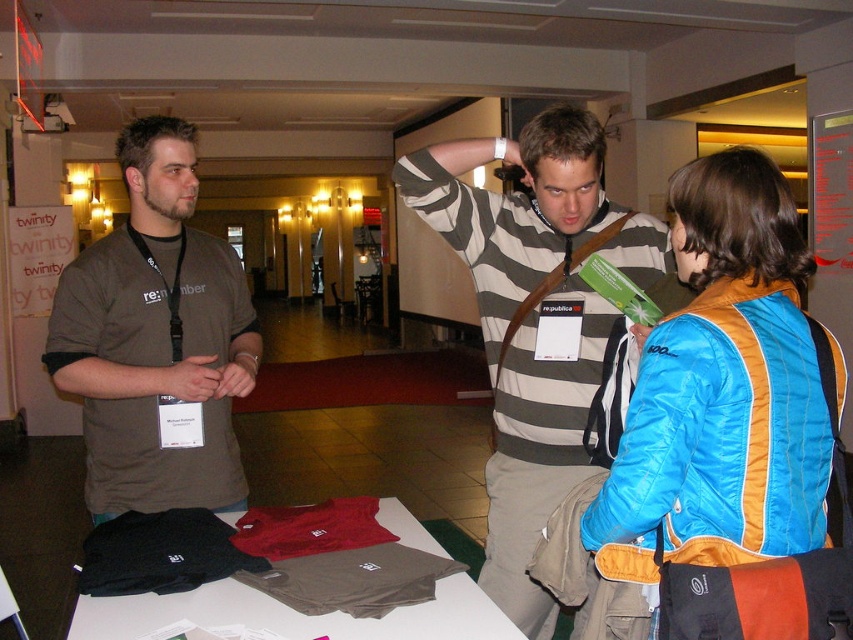
Between blue down jacket at center and striped cotton shirt at center, which one is positioned higher?

blue down jacket at center is above.

You are a GUI agent. You are given a task and a screenshot of the screen. Output one action in this format:
    pyautogui.click(x=<x>, y=<y>)
    Task: Click on the blue down jacket at center
    
    Given the screenshot: What is the action you would take?
    pyautogui.click(x=721, y=390)

I want to click on blue down jacket at center, so click(721, 390).

Between striped cotton shirt at center and matte brown t-shirt at left, which one appears on the left side from the viewer's perspective?

matte brown t-shirt at left is more to the left.

Between striped cotton shirt at center and matte brown t-shirt at left, which one has more height?

striped cotton shirt at center is taller.

Between point (550, 138) and point (183, 259), which one is positioned behind?

Point (183, 259)

The height and width of the screenshot is (640, 853). What are the coordinates of `striped cotton shirt at center` in the screenshot? It's located at (534, 317).

Is blue down jacket at center bigger than matte brown t-shirt at left?

No, blue down jacket at center is not bigger than matte brown t-shirt at left.

Between blue down jacket at center and matte brown t-shirt at left, which one appears on the left side from the viewer's perspective?

Positioned to the left is matte brown t-shirt at left.

Find the location of a particular element. blue down jacket at center is located at coordinates (721, 390).